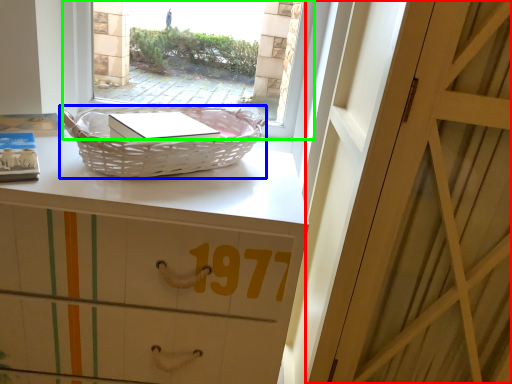
Question: Which object is positioned farthest from door (highlighted by a red box)? Select from picnic basket (highlighted by a blue box) and window (highlighted by a green box).

Choices:
 (A) picnic basket
 (B) window

Answer: (B)